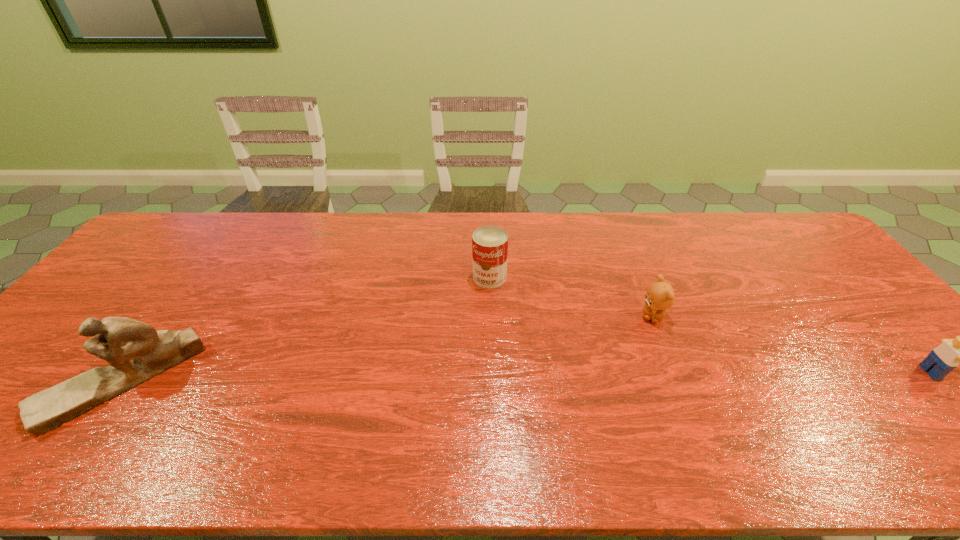
Where is `vacant point located on the face of the third object from left to right`? vacant point located on the face of the third object from left to right is located at coordinates (622, 376).

The height and width of the screenshot is (540, 960). In order to click on vacant space located 0.270m on the face of the third object from left to right in this screenshot , I will do (x=612, y=397).

Where is `object situated at the near edge`? The height and width of the screenshot is (540, 960). object situated at the near edge is located at coordinates (136, 352).

Where is `object located at the left edge`? The image size is (960, 540). object located at the left edge is located at coordinates (136, 352).

Image resolution: width=960 pixels, height=540 pixels. I want to click on object that is positioned at the near left corner, so click(136, 352).

The width and height of the screenshot is (960, 540). In the image, there is a desktop. What are the coordinates of `vacant space at the far edge` in the screenshot? It's located at 538,215.

Locate an element on the screen. free point at the near edge is located at coordinates (665, 406).

The width and height of the screenshot is (960, 540). In the image, there is a desktop. In order to click on vacant space at the left edge in this screenshot , I will do `click(133, 307)`.

You are a GUI agent. You are given a task and a screenshot of the screen. Output one action in this format:
    pyautogui.click(x=<x>, y=<y>)
    Task: Click on the free location at the near left corner
    The image size is (960, 540).
    Given the screenshot: What is the action you would take?
    11,414

Identify the location of free space at the near right corner. (902, 402).